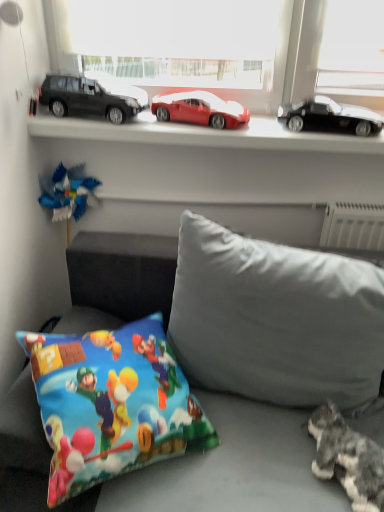
Question: In terms of width, does soft gray fabric couch at lower center look wider or thinner when compared to matte black car at left, which ranks as the first car in left-to-right order?

Choices:
 (A) thin
 (B) wide

Answer: (B)

Question: In the image, is soft gray fabric couch at lower center on the left side or the right side of matte black car at left, which ranks as the first car in left-to-right order?

Choices:
 (A) left
 (B) right

Answer: (B)

Question: Which object is positioned closest to the gray fabric pillow at center, arranged as the 1th pillow when viewed from the right?

Choices:
 (A) metallic cars at upper center
 (B) matte black car at left, which ranks as the first car in left-to-right order
 (C) shiny red car at center, which is counted as the 2th car, starting from the right
 (D) printed fabric pillow at lower left, which appears as the 1th pillow when viewed from the left
 (E) soft gray fabric couch at lower center

Answer: (E)

Question: Based on their relative distances, which object is farther from the gray fluffy cat at lower right?

Choices:
 (A) soft gray fabric couch at lower center
 (B) gray fabric pillow at center, arranged as the 1th pillow when viewed from the right
 (C) shiny red car at center, which is counted as the 2th car, starting from the right
 (D) printed fabric pillow at lower left, which is the second pillow in right-to-left order
 (E) metallic cars at upper center

Answer: (C)